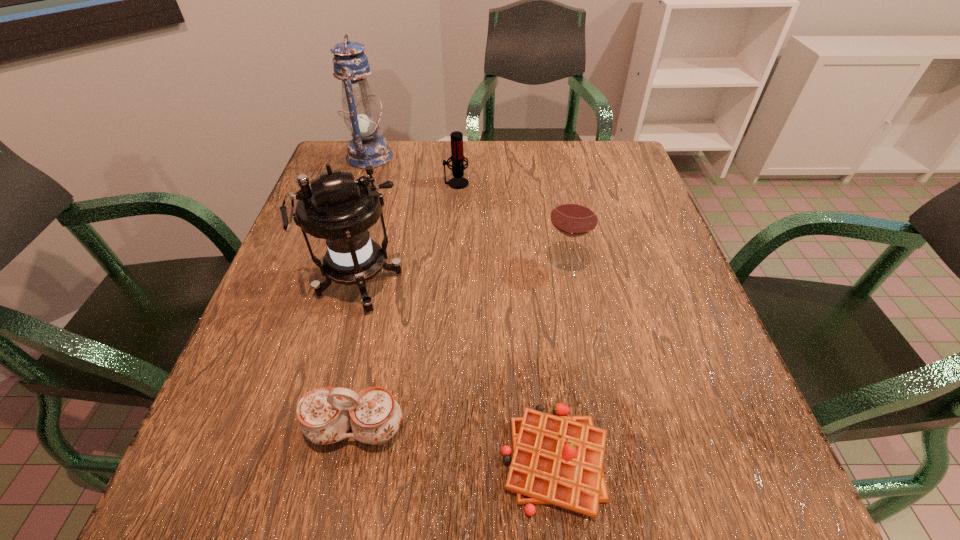
The width and height of the screenshot is (960, 540). I want to click on vacant position at the far left corner of the desktop, so click(x=348, y=151).

At what (x,y) coordinates should I click in order to perform the action: click on vacant point at the far right corner. Please return your answer as a coordinate pair (x, y). The width and height of the screenshot is (960, 540). Looking at the image, I should click on (589, 158).

Find the location of a particular element. vacant area that lies between the nearer lantern and the waffle is located at coordinates (457, 372).

Identify the location of unoccupied position between the third object from right to left and the wineglass. The image size is (960, 540). (511, 225).

Where is `free space between the farther lantern and the wineglass`? This screenshot has width=960, height=540. free space between the farther lantern and the wineglass is located at coordinates (468, 211).

You are a GUI agent. You are given a task and a screenshot of the screen. Output one action in this format:
    pyautogui.click(x=<x>, y=<y>)
    Task: Click on the empty space that is in between the farther lantern and the fourth tallest object
    The image size is (960, 540).
    Given the screenshot: What is the action you would take?
    pyautogui.click(x=413, y=170)

Where is `vacant region between the waffle and the farther lantern`? Image resolution: width=960 pixels, height=540 pixels. vacant region between the waffle and the farther lantern is located at coordinates (463, 308).

Identify the location of free spot between the wineglass and the farther lantern. (468, 211).

The height and width of the screenshot is (540, 960). What are the coordinates of `empty space between the wineglass and the chinaware` in the screenshot? It's located at (461, 347).

Where is `unoccupied position between the wineglass and the fifth nearest object`? unoccupied position between the wineglass and the fifth nearest object is located at coordinates (511, 225).